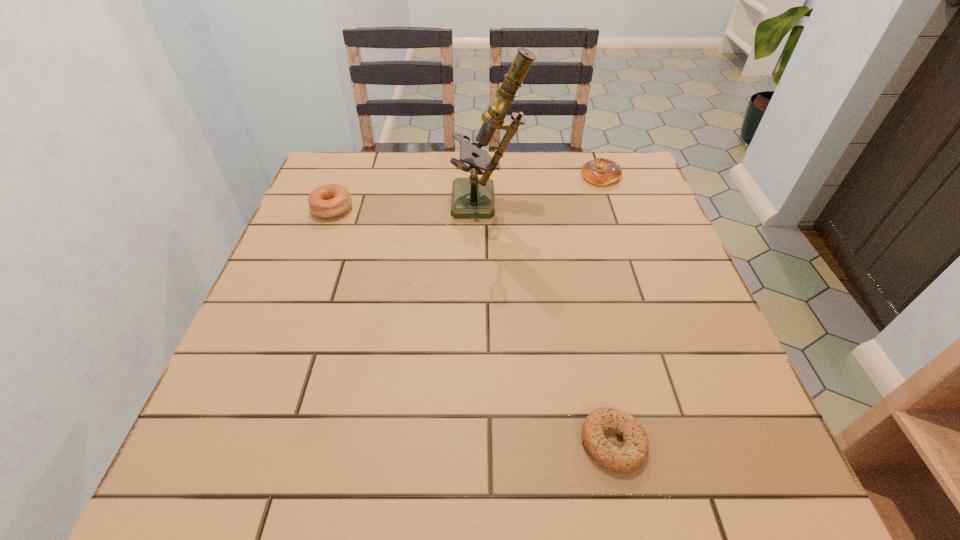
This screenshot has width=960, height=540. Find the location of `free space that is in between the second nearest bagel and the second object from left to right`. free space that is in between the second nearest bagel and the second object from left to right is located at coordinates (410, 207).

At what (x,y) coordinates should I click in order to perform the action: click on free area in between the second object from right to left and the tallest object. Please return your answer as a coordinate pair (x, y). Looking at the image, I should click on tap(551, 323).

The width and height of the screenshot is (960, 540). Identify the location of unoccupied area between the second object from left to right and the rightmost bagel. (544, 190).

Where is `vacant space that is in between the second bagel from left to right and the second object from left to right`? The image size is (960, 540). vacant space that is in between the second bagel from left to right and the second object from left to right is located at coordinates (551, 323).

This screenshot has width=960, height=540. In order to click on object that can be found as the third closest to the rightmost object in this screenshot , I will do `click(632, 454)`.

Identify which object is the second nearest to the rightmost bagel. Please provide its 2D coordinates. Your answer should be formatted as a tuple, i.e. [(x, y)], where the tuple contains the x and y coordinates of a point satisfying the conditions above.

[(327, 201)]

You are a GUI agent. You are given a task and a screenshot of the screen. Output one action in this format:
    pyautogui.click(x=<x>, y=<y>)
    Task: Click on the bagel object that ranks as the closest to the third object from left to right
    The width and height of the screenshot is (960, 540).
    Given the screenshot: What is the action you would take?
    pyautogui.click(x=602, y=171)

Locate which bagel is the second closest to the rightmost bagel. Please provide its 2D coordinates. Your answer should be formatted as a tuple, i.e. [(x, y)], where the tuple contains the x and y coordinates of a point satisfying the conditions above.

[(632, 454)]

The width and height of the screenshot is (960, 540). Identify the location of free spot that satisfies the following two spatial constraints: 1. at the eyepiece of the third object from right to left; 2. on the left side of the second bagel from left to right. (493, 442).

Locate an element on the screen. free spot that satisfies the following two spatial constraints: 1. at the eyepiece of the tallest object; 2. on the left side of the nearest object is located at coordinates (493, 442).